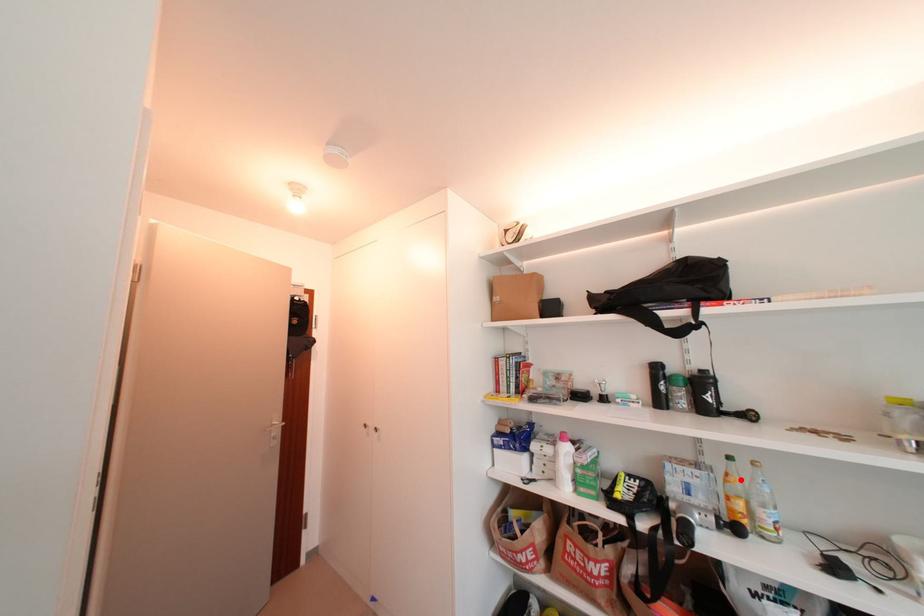
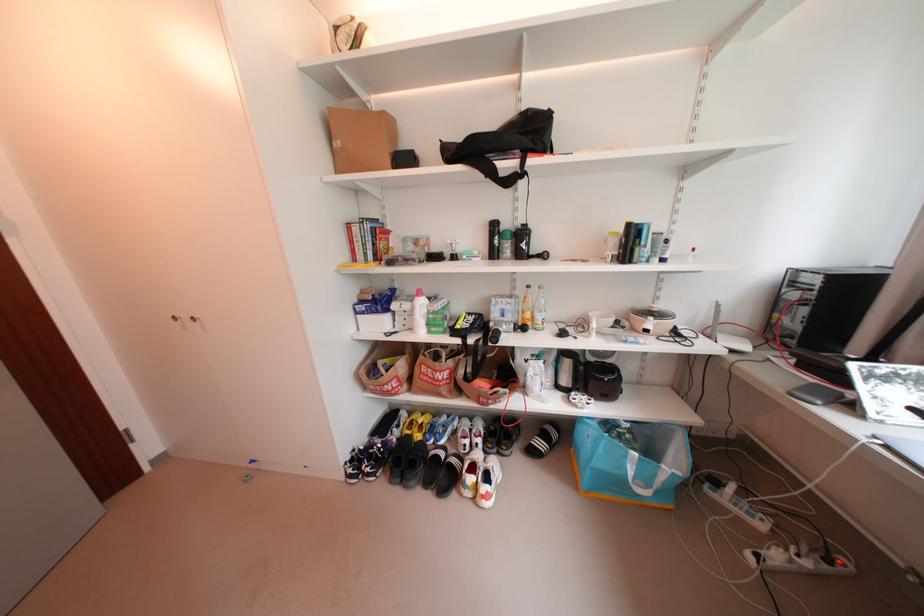
The point at the highlighted location is marked in the first image. Where is the corresponding point in the second image?

(536, 301)